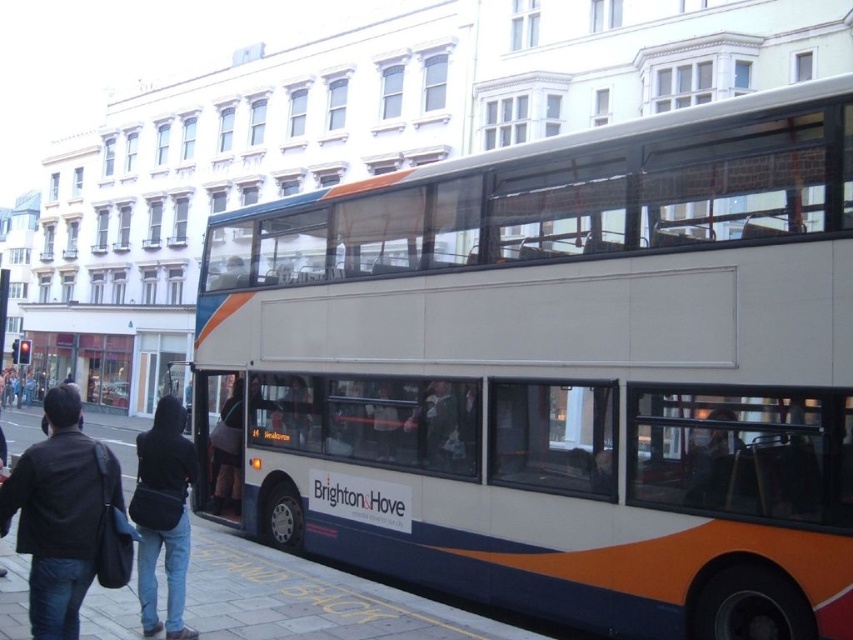
Question: Which point is farther from the camera taking this photo?

Choices:
 (A) (57, 531)
 (B) (488, 420)
 (C) (183, 563)

Answer: (B)

Question: Which object appears closest to the camera in this image?

Choices:
 (A) smooth concrete pavement at lower center
 (B) white glossy bus at center

Answer: (B)

Question: Which point is farther to the camera?

Choices:
 (A) white glossy bus at center
 (B) black leather jacket at lower left
 (C) black fabric bag at lower left
 (D) smooth concrete pavement at lower center

Answer: (C)

Question: Can you confirm if smooth concrete pavement at lower center is wider than black leather jacket at lower left?

Choices:
 (A) yes
 (B) no

Answer: (B)

Question: From the image, what is the correct spatial relationship of white glossy bus at center in relation to black fabric bag at lower left?

Choices:
 (A) below
 (B) above

Answer: (B)

Question: Is black leather jacket at lower left above black fabric bag at lower left?

Choices:
 (A) no
 (B) yes

Answer: (A)